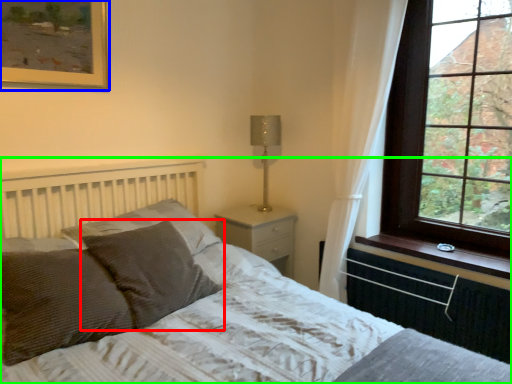
Question: Which is farther away from pillow (highlighted by a red box)? picture frame (highlighted by a blue box) or bed (highlighted by a green box)?

Choices:
 (A) picture frame
 (B) bed

Answer: (A)